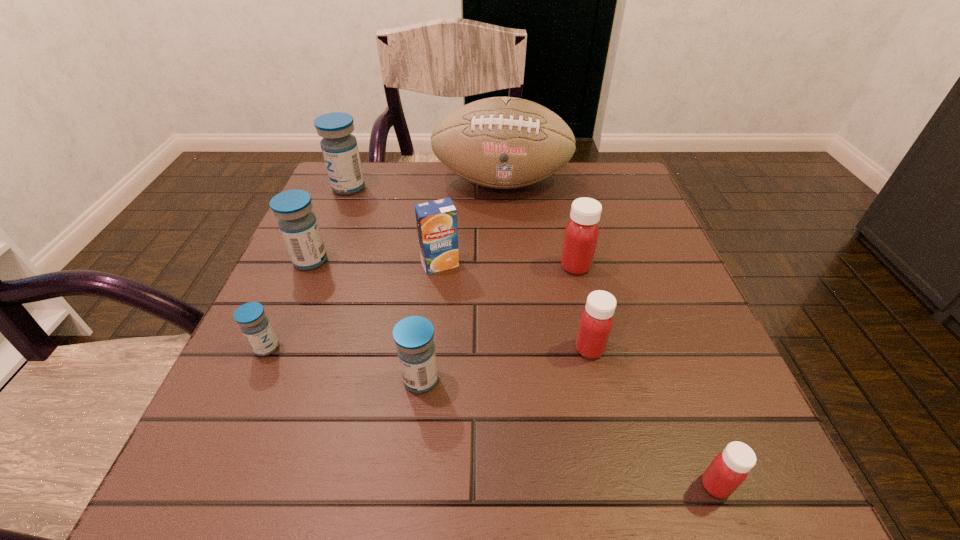
Locate an element on the screen. This screenshot has width=960, height=540. free location that satisfies the following two spatial constraints: 1. on the back side of the biggest red medicine; 2. on the right side of the second farthest red medicine is located at coordinates (571, 266).

Where is `blank area in the image that satisfies the following two spatial constraints: 1. on the front side of the rightmost blue medicine; 2. on the right side of the second nearest blue medicine`? blank area in the image that satisfies the following two spatial constraints: 1. on the front side of the rightmost blue medicine; 2. on the right side of the second nearest blue medicine is located at coordinates (252, 380).